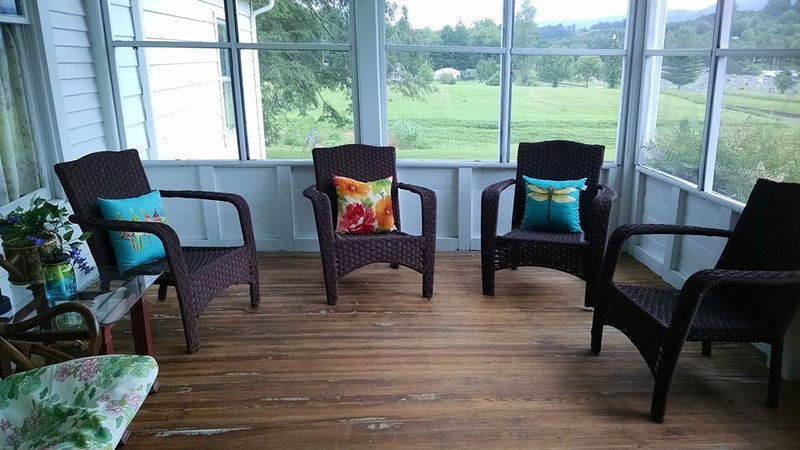
You are a GUI agent. You are given a task and a screenshot of the screen. Output one action in this format:
    pyautogui.click(x=<x>, y=<y>)
    Task: Click on the pillow
    The width and height of the screenshot is (800, 450).
    Given the screenshot: What is the action you would take?
    pyautogui.click(x=536, y=198)